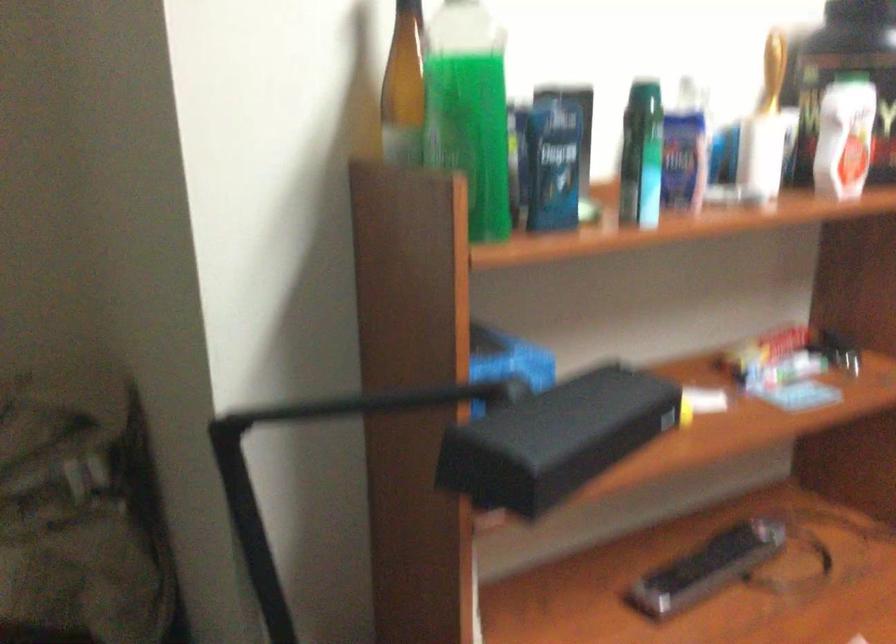
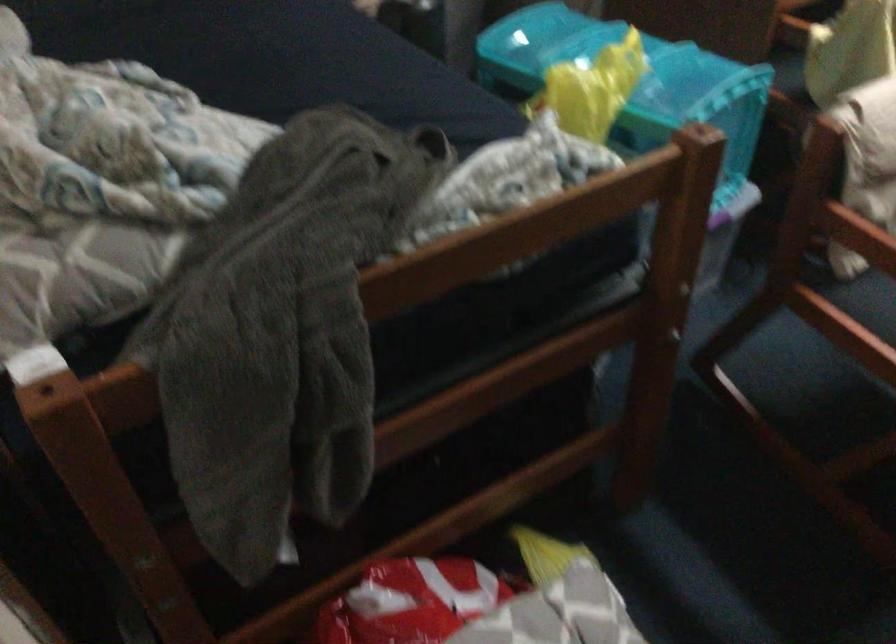
The images are taken continuously from a first-person perspective. In which direction are you moving?

The movement direction of the cameraman is left, backward.